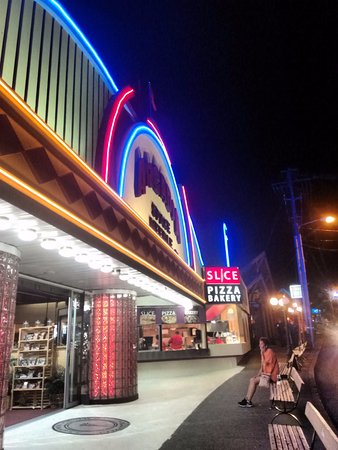
Locate an element on the screen. The height and width of the screenshot is (450, 338). bench is located at coordinates (287, 385), (293, 358), (284, 434).